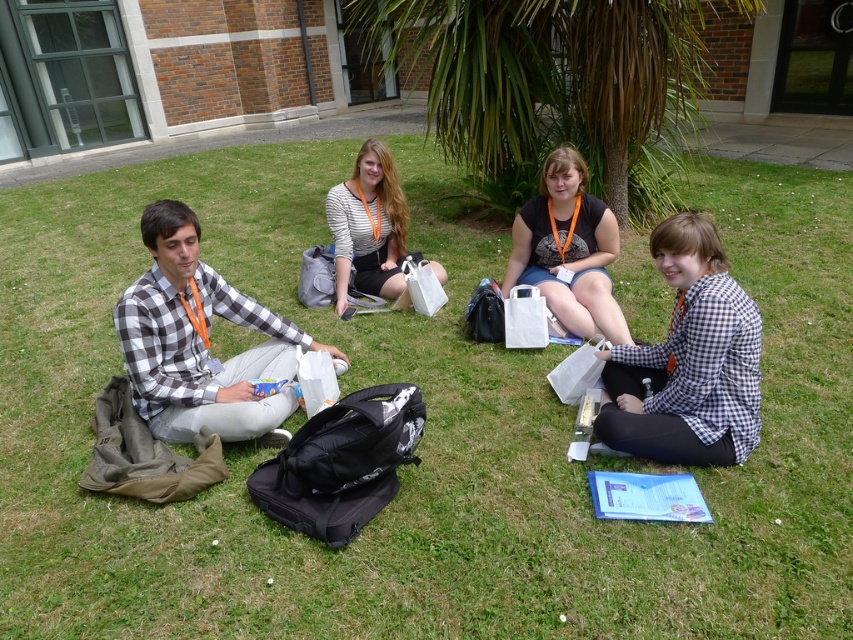
Question: Among these points, which one is farthest from the camera?

Choices:
 (A) (258, 353)
 (B) (584, 310)
 (C) (606, 433)

Answer: (B)

Question: Where is white checkered shirt at lower right located in relation to striped cotton shirt at center in the image?

Choices:
 (A) left
 (B) right

Answer: (B)

Question: Considering the real-world distances, which object is farthest from the white checkered shirt at lower right?

Choices:
 (A) checkered fabric shirt at left
 (B) striped cotton shirt at center

Answer: (B)

Question: Estimate the real-world distances between objects in this image. Which object is closer to the checkered fabric shirt at left?

Choices:
 (A) white checkered shirt at lower right
 (B) striped cotton shirt at center

Answer: (B)

Question: Where is white checkered shirt at lower right located in relation to camouflage t-shirt at center in the image?

Choices:
 (A) left
 (B) right

Answer: (B)

Question: Can you confirm if checkered fabric shirt at left is positioned below striped cotton shirt at center?

Choices:
 (A) no
 (B) yes

Answer: (B)